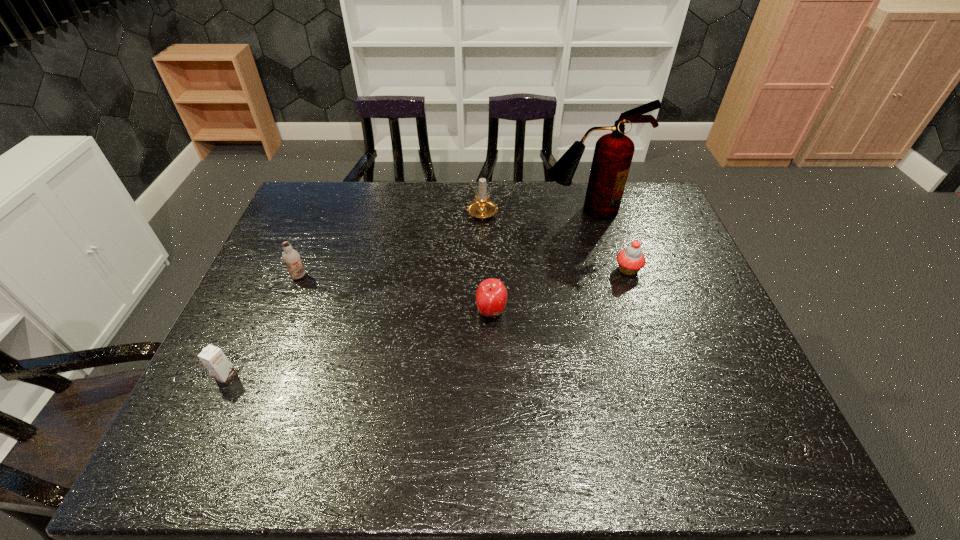
The width and height of the screenshot is (960, 540). Identify the location of the tallest object. [x=613, y=153].

At what (x,y) coordinates should I click in order to perform the action: click on candle. Please return your answer as a coordinate pair (x, y). The image size is (960, 540). Looking at the image, I should click on (482, 208).

What are the coordinates of `the right chocolate milk` in the screenshot? It's located at (291, 257).

The image size is (960, 540). I want to click on the fifth object from right to left, so click(x=291, y=257).

I want to click on apple, so click(x=491, y=296).

Find the location of a particular element. This screenshot has height=540, width=960. cupcake is located at coordinates (631, 260).

The width and height of the screenshot is (960, 540). I want to click on the left chocolate milk, so click(x=213, y=358).

Locate an element on the screen. This screenshot has height=540, width=960. the shorter chocolate milk is located at coordinates (213, 358).

This screenshot has height=540, width=960. In order to click on free space located 0.130m at the nozzle of the tallest object in this screenshot , I will do `click(598, 247)`.

Locate an element on the screen. free space located 0.190m on the front of the candle is located at coordinates (483, 267).